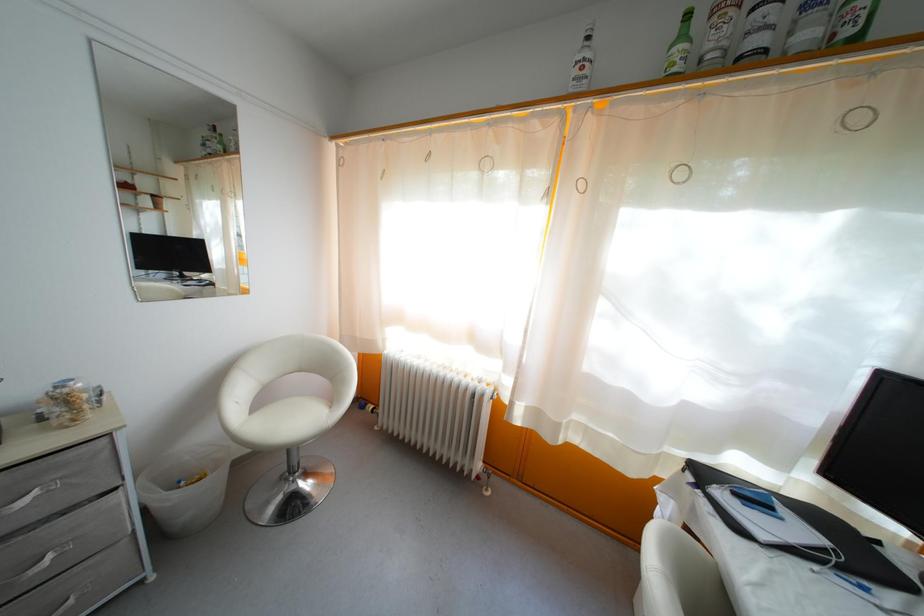
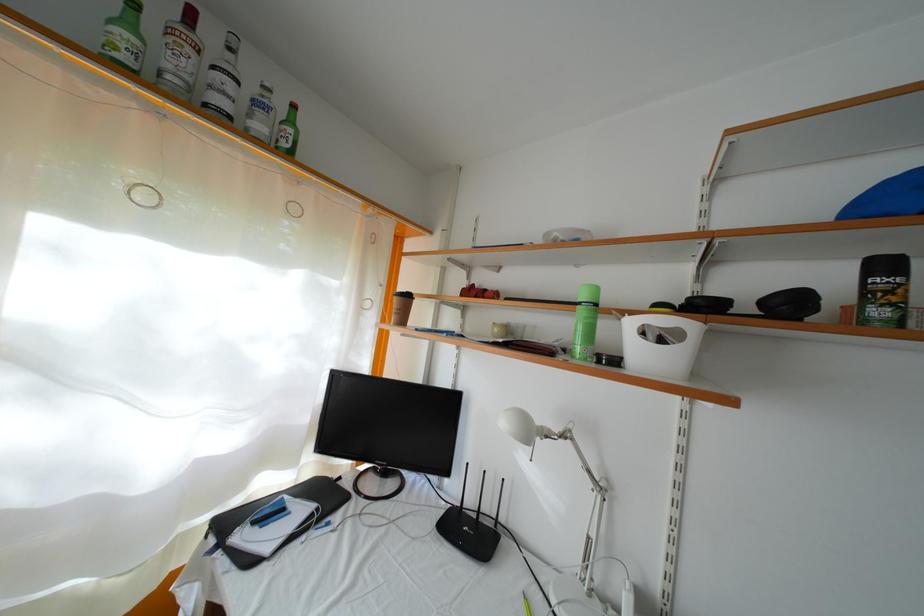
Locate, in the second image, the point that corresponds to the point at 860,561 in the first image.

(334, 506)